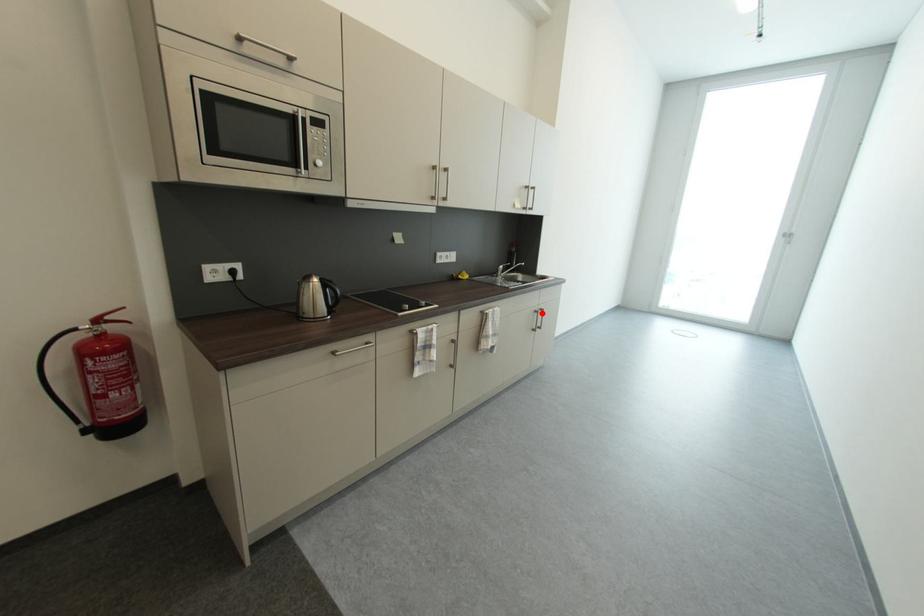
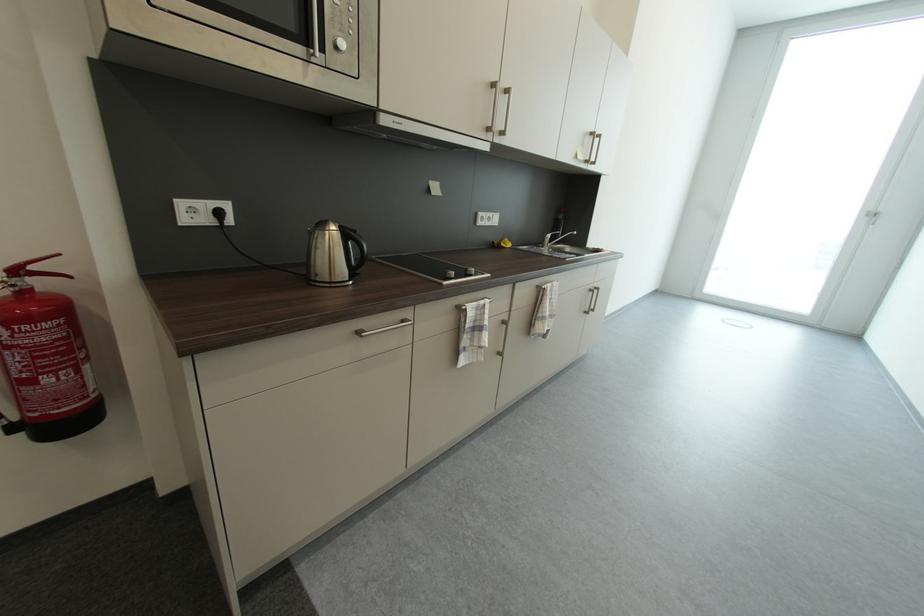
Locate, in the second image, the point that corresponds to the highlighted location in the first image.

(598, 292)